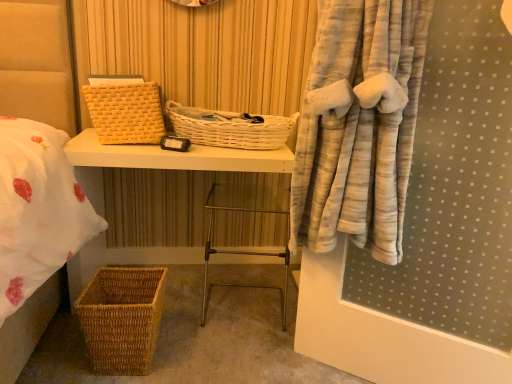
Question: Would you say white wicker basket at center, the 2th basket in the top-to-bottom sequence, is outside woven wicker basket at lower left?

Choices:
 (A) yes
 (B) no

Answer: (A)

Question: From a real-world perspective, is white wicker basket at center, which is the 2th basket in bottom-to-top order, below woven wicker basket at lower left?

Choices:
 (A) no
 (B) yes

Answer: (A)

Question: From the image's perspective, is white wicker basket at center, the 2th basket in the top-to-bottom sequence, beneath woven wicker basket at lower left?

Choices:
 (A) yes
 (B) no

Answer: (B)

Question: Is woven wicker basket at lower left a part of white wicker basket at center, the 2th basket in the top-to-bottom sequence?

Choices:
 (A) no
 (B) yes

Answer: (A)

Question: Does white wicker basket at center, which is the 2th basket in bottom-to-top order, turn towards woven wicker basket at lower left?

Choices:
 (A) yes
 (B) no

Answer: (B)

Question: From a real-world perspective, is metallic silver step stool at center positioned above or below yellow woven basket at upper left, which is the 3th basket from bottom to top?

Choices:
 (A) below
 (B) above

Answer: (A)

Question: From the image's perspective, is metallic silver step stool at center positioned above or below yellow woven basket at upper left, which is the 3th basket from bottom to top?

Choices:
 (A) above
 (B) below

Answer: (B)

Question: Would you say metallic silver step stool at center is to the left or to the right of yellow woven basket at upper left, the first basket viewed from the top, in the picture?

Choices:
 (A) right
 (B) left

Answer: (A)

Question: Is metallic silver step stool at center taller or shorter than yellow woven basket at upper left, the first basket viewed from the top?

Choices:
 (A) short
 (B) tall

Answer: (B)

Question: Is yellow woven basket at upper left, the first basket viewed from the top, situated inside metallic silver step stool at center or outside?

Choices:
 (A) outside
 (B) inside

Answer: (A)

Question: Looking at the image, does yellow woven basket at upper left, which is the 3th basket from bottom to top, seem bigger or smaller compared to metallic silver step stool at center?

Choices:
 (A) big
 (B) small

Answer: (B)

Question: Looking at their shapes, would you say yellow woven basket at upper left, the first basket viewed from the top, is wider or thinner than metallic silver step stool at center?

Choices:
 (A) thin
 (B) wide

Answer: (A)

Question: Considering their positions, is yellow woven basket at upper left, which is the 3th basket from bottom to top, located in front of or behind metallic silver step stool at center?

Choices:
 (A) front
 (B) behind

Answer: (A)

Question: Considering the positions of woven wicker basket at lower left and white wicker basket at center, which is the 2th basket in bottom-to-top order, in the image, is woven wicker basket at lower left wider or thinner than white wicker basket at center, which is the 2th basket in bottom-to-top order,?

Choices:
 (A) wide
 (B) thin

Answer: (A)

Question: Is woven wicker basket at lower left taller or shorter than white wicker basket at center, which is the 2th basket in bottom-to-top order?

Choices:
 (A) short
 (B) tall

Answer: (B)